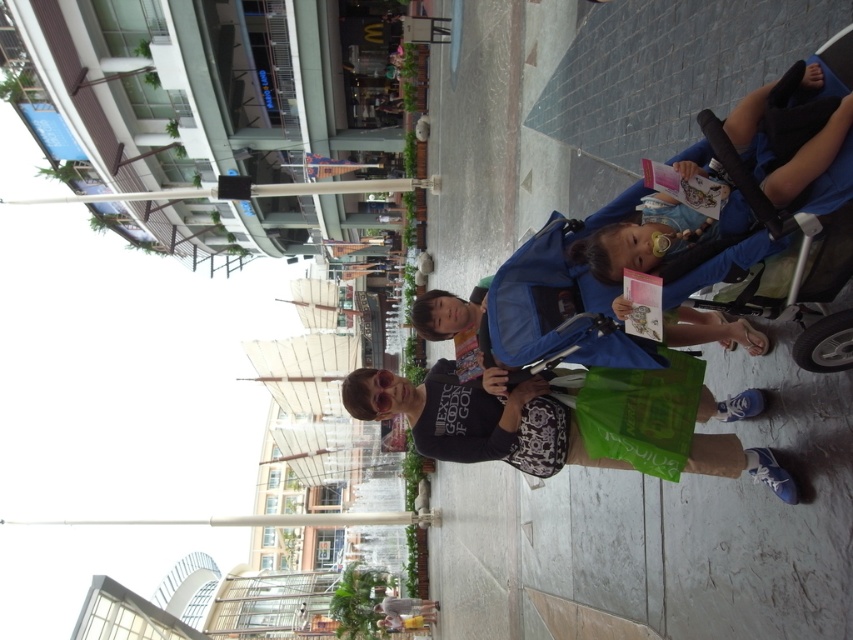
Is blue fabric baby carriage at center below black matte t-shirt at center?

No.

Between blue fabric baby carriage at center and black matte t-shirt at center, which one has more height?

blue fabric baby carriage at center is taller.

Does point (746, 173) come in front of point (714, 440)?

Yes.

You are a GUI agent. You are given a task and a screenshot of the screen. Output one action in this format:
    pyautogui.click(x=<x>, y=<y>)
    Task: Click on the blue fabric baby carriage at center
    
    Given the screenshot: What is the action you would take?
    pyautogui.click(x=563, y=294)